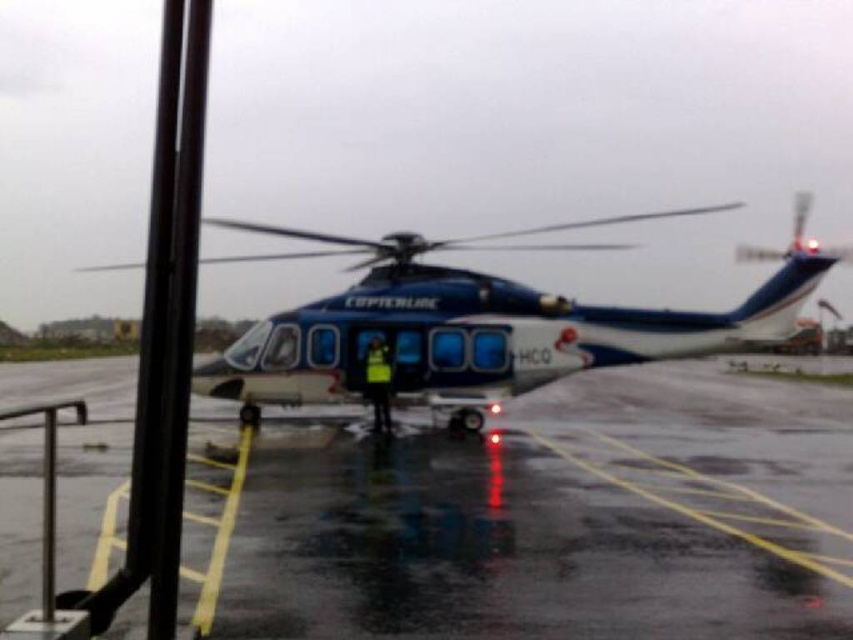
You are a pilot preparing to board the helicopter. You see the point marked at coordinate (546, 518). What is located at that point?

The point marked at coordinate (546, 518) marks glossy asphalt tarmac at center.

You are a pilot preparing to board the blue glossy helicopter at center. You notice the glossy asphalt tarmac at center beneath you. Is the helicopter currently in flight or on the ground?

The glossy asphalt tarmac at center is located below the blue glossy helicopter at center, which means the helicopter is on the ground and not in flight.